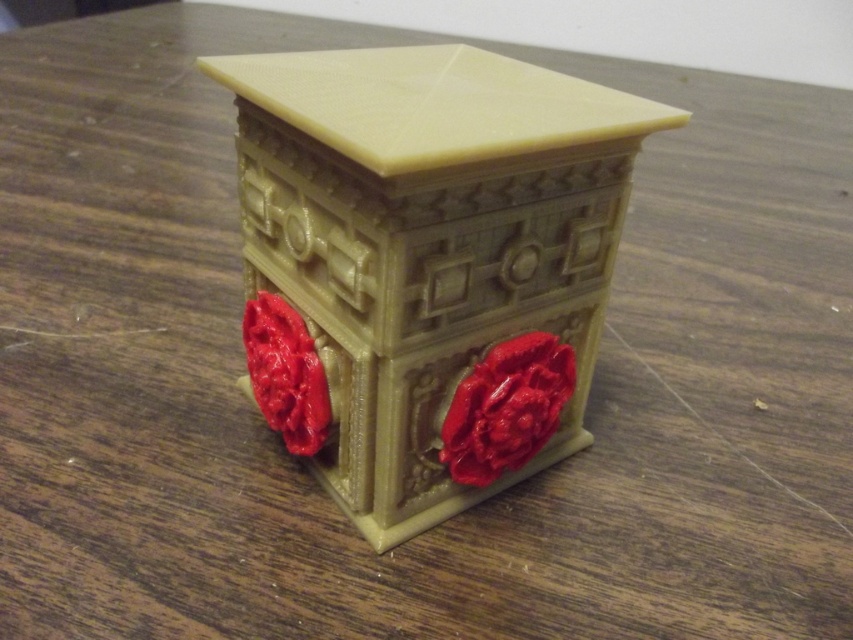
You are an interior designer arranging a shelf and see the matte beige cabinet at center and the matte plastic flower at center. Which object is closer to you?

The matte beige cabinet at center is closer to you because it is in front of the matte plastic flower at center.

You are an interior designer arranging a shelf. You have a matte beige cabinet at center and a matte plastic flower at center. According to the scene, which object should be placed higher on the shelf?

The matte beige cabinet at center should be placed higher on the shelf since it is positioned above the matte plastic flower at center in the scene.